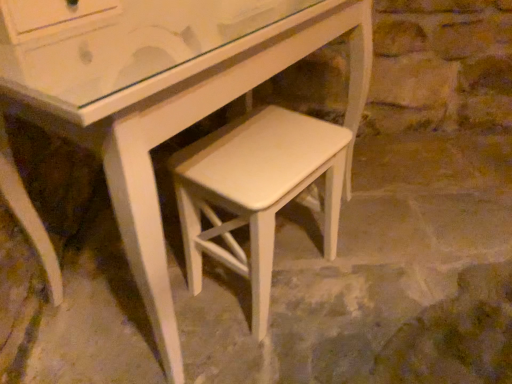
This screenshot has width=512, height=384. In order to click on vacant space underneath white matte stool at center (from a real-world perspective) in this screenshot , I will do `click(275, 279)`.